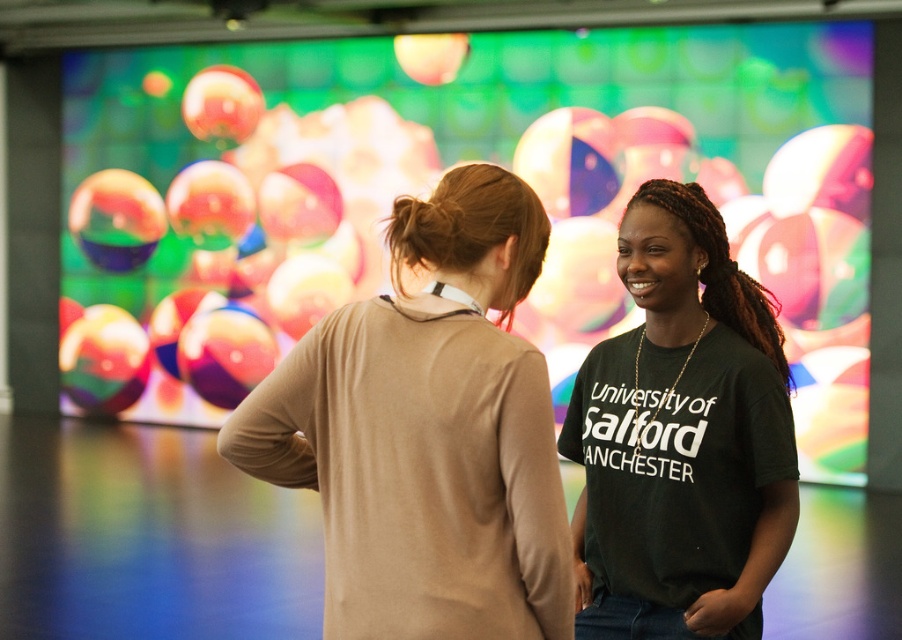
Can you confirm if matte beige sweater at center is shorter than dark green t-shirt at center?

Yes, matte beige sweater at center is shorter than dark green t-shirt at center.

Can you confirm if matte beige sweater at center is positioned to the right of dark green t-shirt at center?

Incorrect, matte beige sweater at center is not on the right side of dark green t-shirt at center.

What do you see at coordinates (428, 433) in the screenshot? I see `matte beige sweater at center` at bounding box center [428, 433].

I want to click on matte beige sweater at center, so click(428, 433).